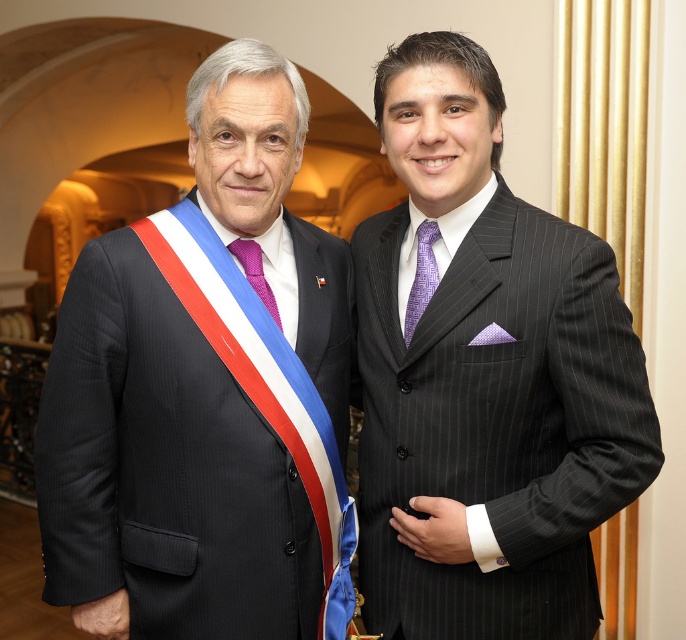
Is point (383, 92) closer to camera compared to point (431, 280)?

Yes, point (383, 92) is in front of point (431, 280).

The image size is (686, 640). What do you see at coordinates (484, 378) in the screenshot?
I see `pinstriped suit at right` at bounding box center [484, 378].

I want to click on pinstriped suit at right, so click(x=484, y=378).

Which is behind, point (434, 208) or point (259, 260)?

Point (259, 260)

Is pinstriped suit at right shorter than purple knitted tie at center?

No, pinstriped suit at right is not shorter than purple knitted tie at center.

What do you see at coordinates (484, 378) in the screenshot? I see `pinstriped suit at right` at bounding box center [484, 378].

The height and width of the screenshot is (640, 686). What are the coordinates of `pinstriped suit at right` in the screenshot? It's located at (484, 378).

Who is positioned more to the right, matte black suit at left or pinstriped suit at right?

pinstriped suit at right is more to the right.

I want to click on matte black suit at left, so click(x=204, y=394).